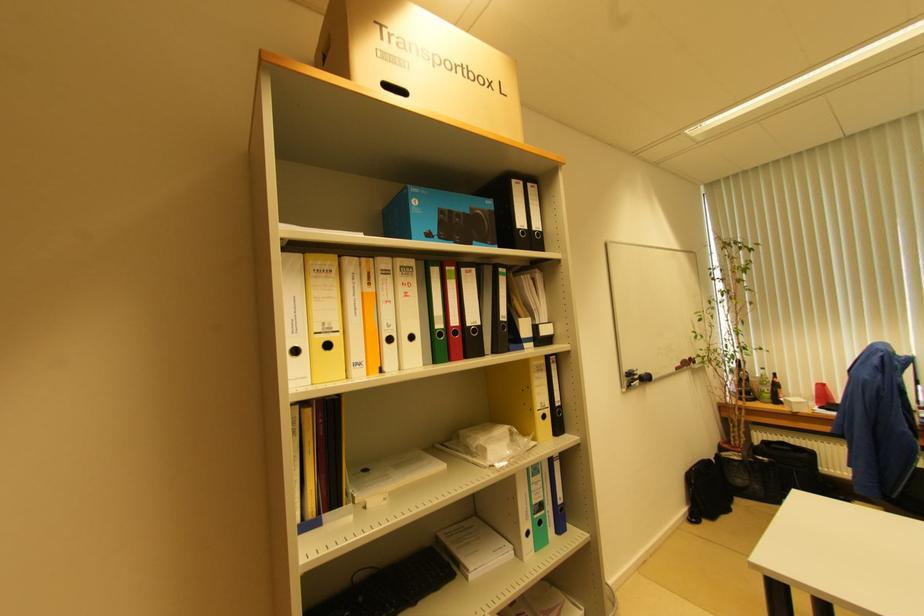
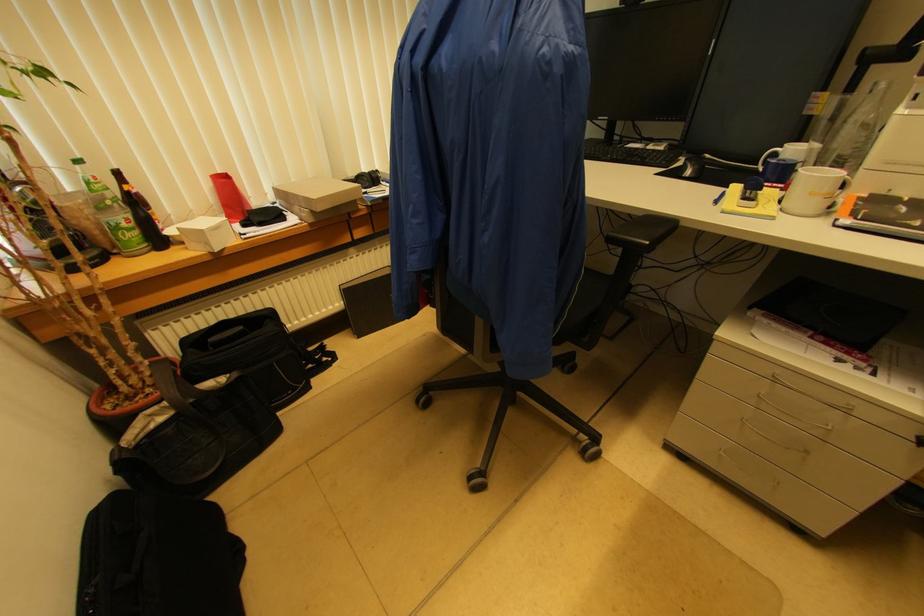
Locate, in the second image, the point that corresponds to (x=775, y=377) in the first image.

(118, 176)